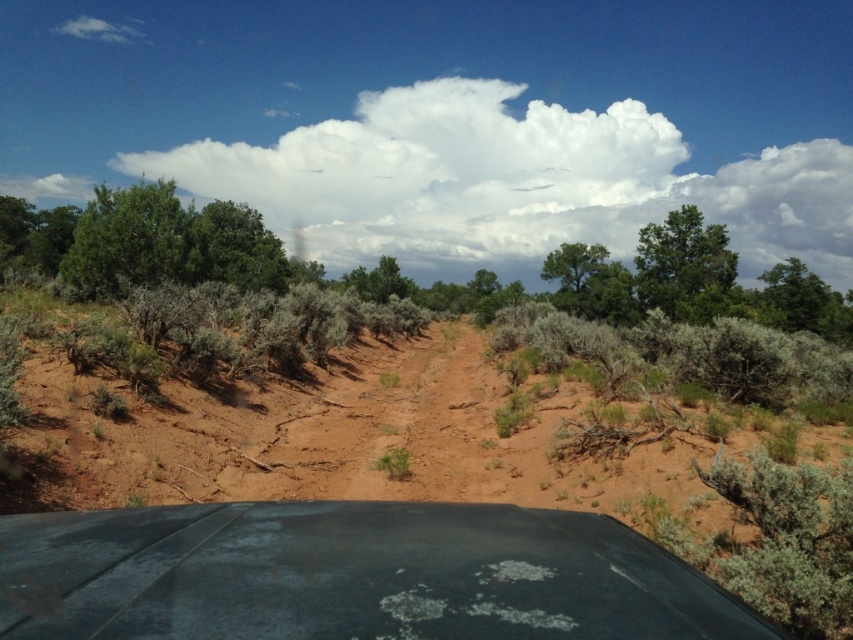
Question: Does matte black windshield at center have a lesser width compared to green leafy tree at upper center?

Choices:
 (A) no
 (B) yes

Answer: (B)

Question: Is white fluffy cloud at upper center thinner than green leafy tree at upper center?

Choices:
 (A) yes
 (B) no

Answer: (B)

Question: Is white fluffy cloud at upper center to the left of green leafy tree at right from the viewer's perspective?

Choices:
 (A) yes
 (B) no

Answer: (A)

Question: Which is nearer to the green leafy tree at upper center?

Choices:
 (A) white fluffy cloud at upper center
 (B) green leafy tree at right
 (C) matte black windshield at center

Answer: (B)

Question: Which object is the farthest from the white fluffy cloud at upper center?

Choices:
 (A) matte black windshield at center
 (B) green leafy tree at right
 (C) green leafy tree at upper center

Answer: (A)

Question: Estimate the real-world distances between objects in this image. Which object is farther from the green leafy tree at upper center?

Choices:
 (A) matte black windshield at center
 (B) green leafy tree at right

Answer: (A)